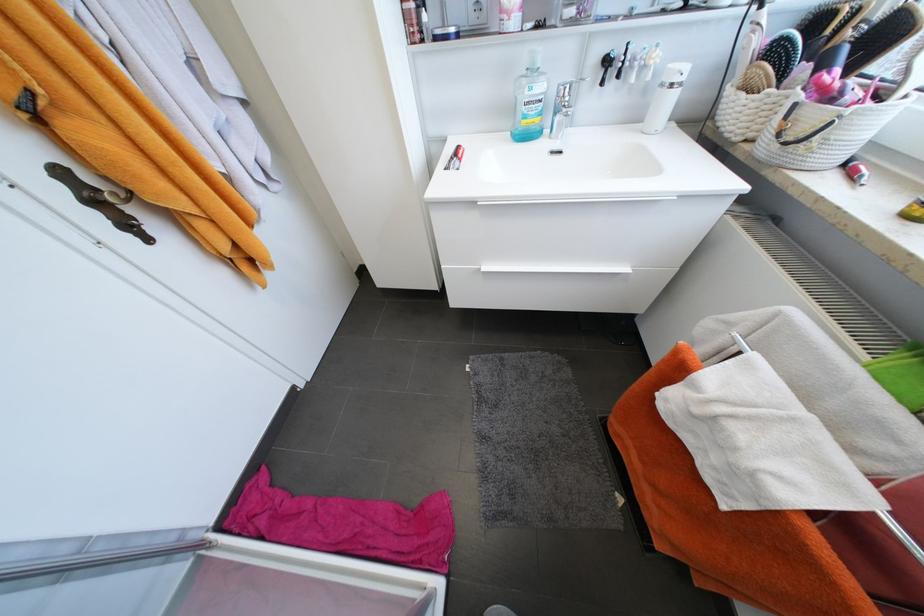
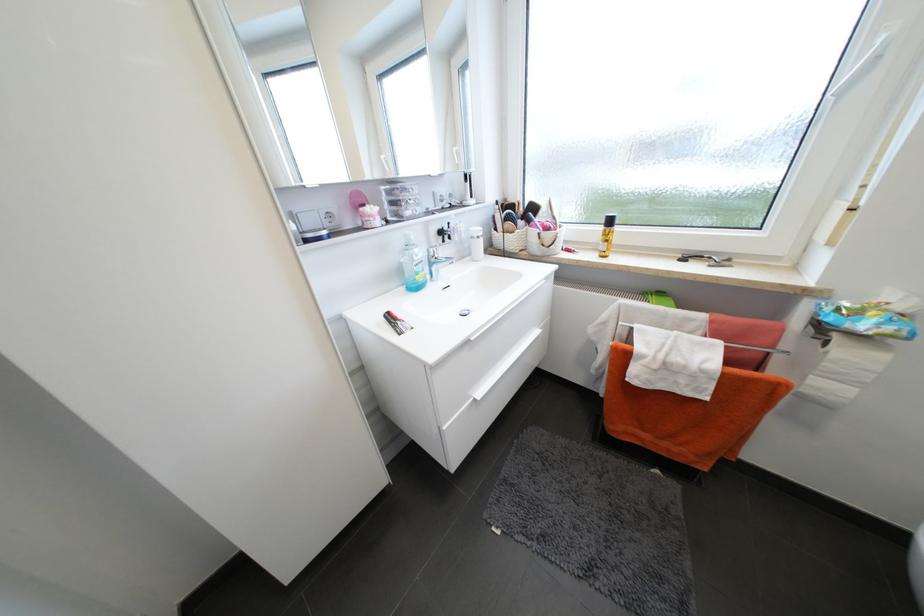
Find the pixel in the second image that matches point (667, 86) in the first image.

(478, 238)